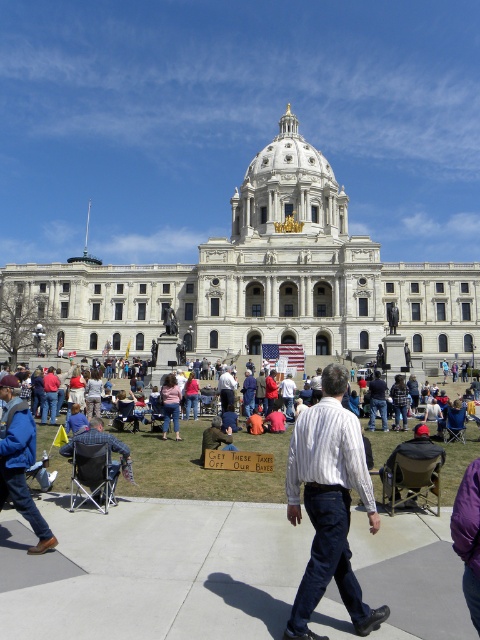
You are a photographer standing in front of the grand neoclassical building with a dome. You notice two denim jackets in the crowd. The first is a blue denim jacket at lower left, and the second is a denim jacket at center. Which denim jacket is more to the left?

The blue denim jacket at lower left is more to the left because it is positioned on the left side of the denim jacket at center.